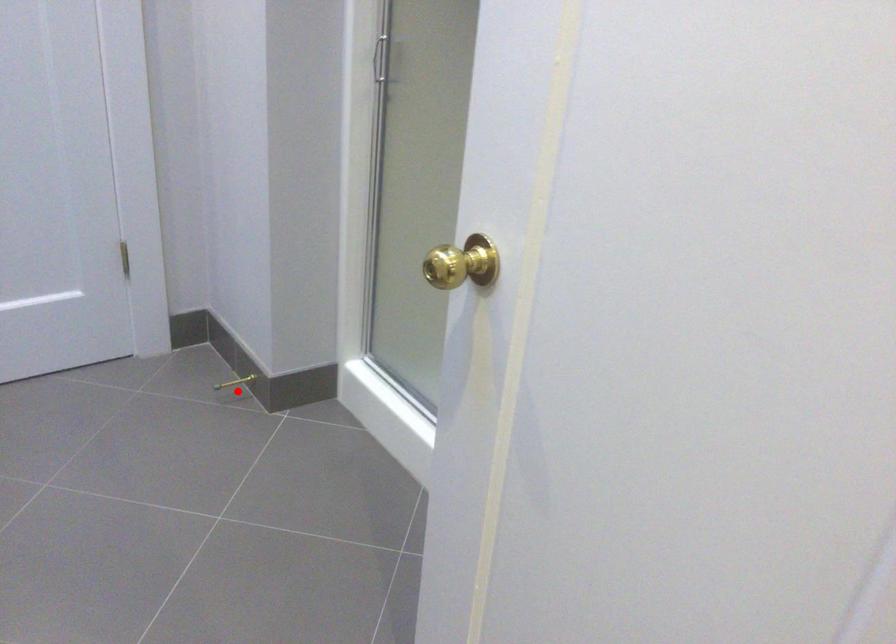
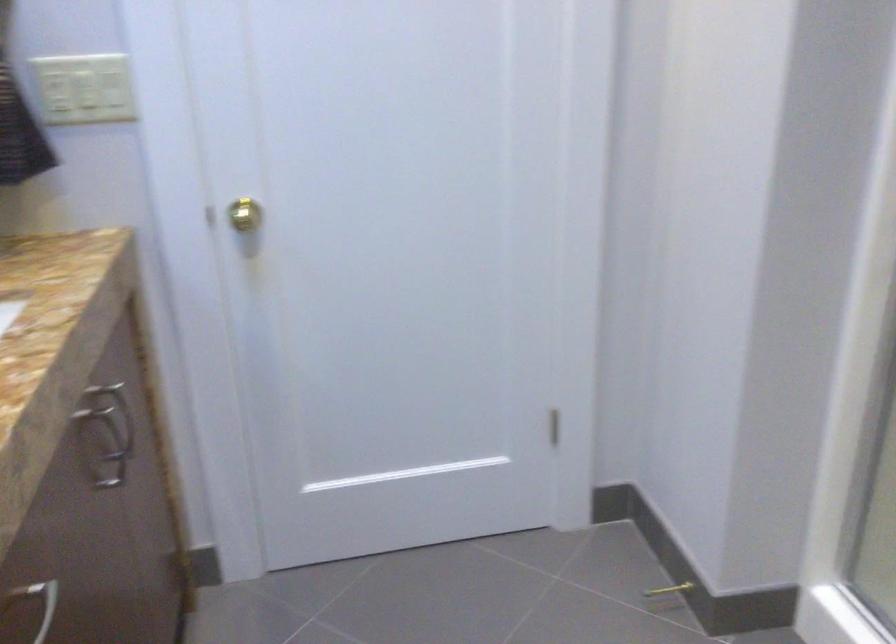
Where in the second image is the point corresponding to the highlighted location from the first image?

(666, 596)